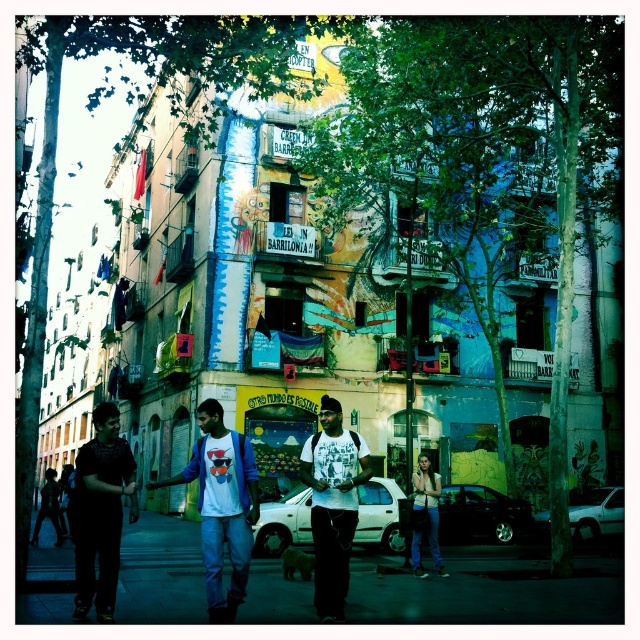
Question: Is white cotton t-shirt at center thinner than white matte t-shirt at center?

Choices:
 (A) no
 (B) yes

Answer: (A)

Question: Which of the following is the closest to the observer?

Choices:
 (A) (97, 460)
 (B) (332, 460)
 (C) (193, 536)
 (D) (236, 449)

Answer: (D)

Question: Based on their relative distances, which object is nearer to the white matte t-shirt at center?

Choices:
 (A) dark asphalt pavement at lower center
 (B) white cotton t-shirt at center

Answer: (B)

Question: Can you confirm if dark asphalt pavement at lower center is positioned to the right of white cotton t-shirt at center?

Choices:
 (A) yes
 (B) no

Answer: (A)

Question: Which point appears closest to the camera in this image?

Choices:
 (A) (248, 552)
 (B) (492, 557)
 (C) (104, 451)

Answer: (A)

Question: Is dark asphalt pavement at lower center smaller than white matte t-shirt at center?

Choices:
 (A) yes
 (B) no

Answer: (B)